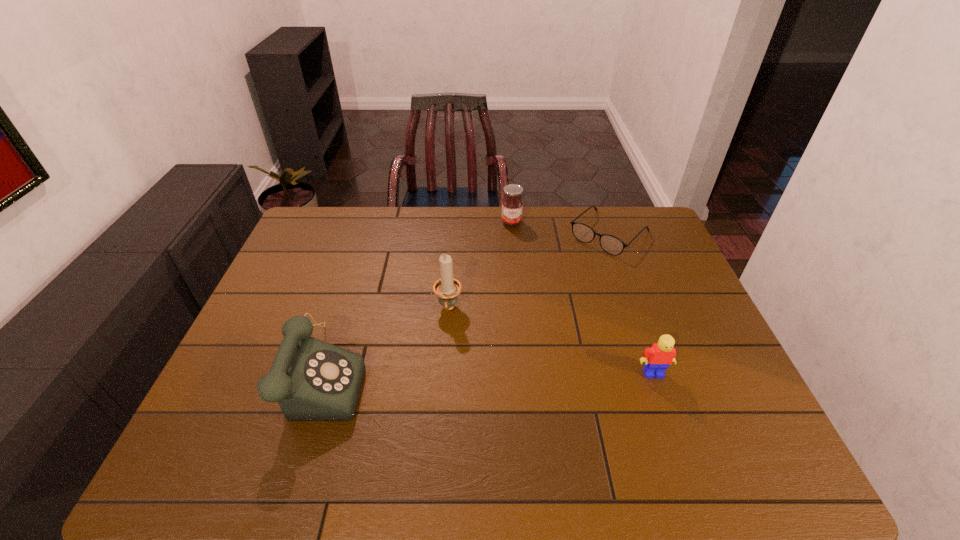
The image size is (960, 540). I want to click on object that is at the near edge, so click(312, 380).

I want to click on object positioned at the left edge, so point(312,380).

At what (x,y) coordinates should I click in order to perform the action: click on Lego positioned at the right edge. Please return your answer as a coordinate pair (x, y). This screenshot has width=960, height=540. Looking at the image, I should click on (657, 358).

Identify the location of spectacles present at the right edge. This screenshot has width=960, height=540. (612, 245).

This screenshot has height=540, width=960. Find the location of `object present at the near left corner`. object present at the near left corner is located at coordinates (312, 380).

The image size is (960, 540). I want to click on object at the far right corner, so click(x=612, y=245).

You are a GUI agent. You are given a task and a screenshot of the screen. Output one action in this format:
    pyautogui.click(x=<x>, y=<y>)
    Task: Click on the free spot at the far edge of the desktop
    This screenshot has width=960, height=540.
    Given the screenshot: What is the action you would take?
    pyautogui.click(x=423, y=242)

You are a GUI agent. You are given a task and a screenshot of the screen. Output one action in this format:
    pyautogui.click(x=<x>, y=<y>)
    Task: Click on the vacant space at the near edge of the desktop
    
    Given the screenshot: What is the action you would take?
    pyautogui.click(x=430, y=426)

The image size is (960, 540). In the image, there is a desktop. What are the coordinates of `vacant space at the left edge` in the screenshot? It's located at (313, 294).

I want to click on vacant space at the right edge, so click(655, 266).